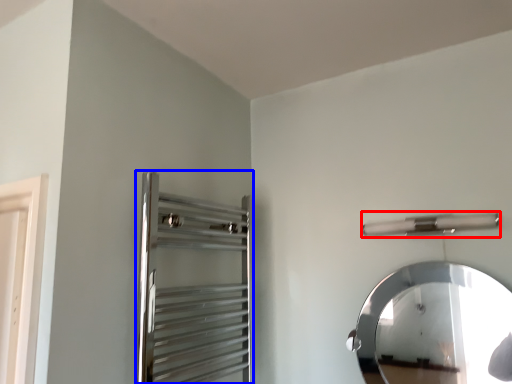
Question: Among these objects, which one is nearest to the camera, towel bar (highlighted by a red box) or screen door (highlighted by a blue box)?

Choices:
 (A) towel bar
 (B) screen door

Answer: (B)